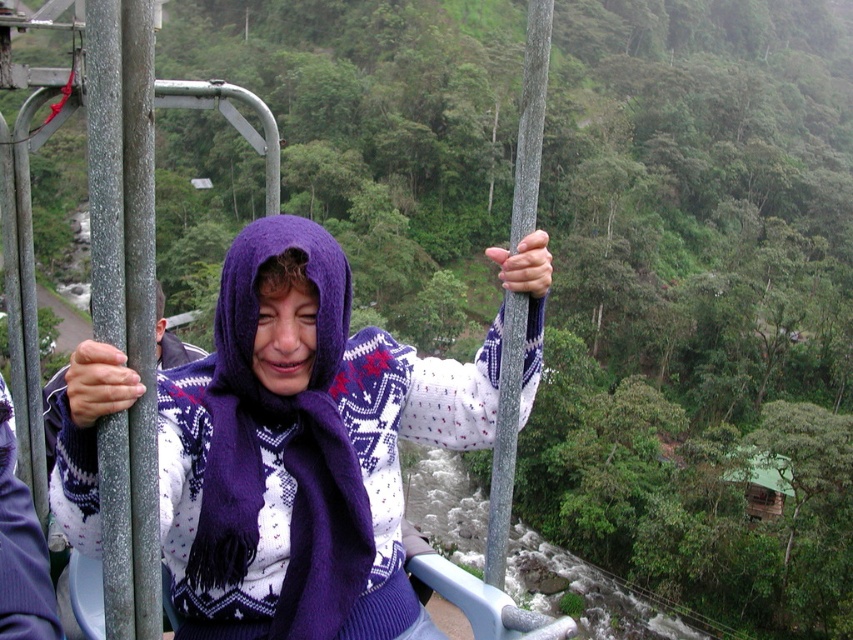
Looking at this image, who is more distant from viewer, (180,637) or (152,198)?

Point (180,637)

Measure the distance from purple knitted sweater at center to smooth gray pole at left.

purple knitted sweater at center and smooth gray pole at left are 4.73 feet apart from each other.

Find the location of a particular element. Image resolution: width=853 pixels, height=640 pixels. purple knitted sweater at center is located at coordinates (299, 444).

Who is more forward, (532,353) or (515,376)?

Point (515,376)

Is the position of purple knitted sweater at center more distant than that of smooth metal pole at center?

Yes, purple knitted sweater at center is behind smooth metal pole at center.

Who is more forward, (402, 369) or (514, 227)?

Positioned in front is point (514, 227).

Image resolution: width=853 pixels, height=640 pixels. I want to click on purple knitted sweater at center, so click(x=299, y=444).

Can you confirm if smooth gray pole at left is positioned to the right of smooth metal pole at center?

Incorrect, smooth gray pole at left is not on the right side of smooth metal pole at center.

Is the position of smooth gray pole at left less distant than that of smooth metal pole at center?

Yes, smooth gray pole at left is closer to the viewer.

Does point (107, 358) come closer to viewer compared to point (527, 19)?

Yes, it is.

Identify the location of smooth gray pole at left. (125, 301).